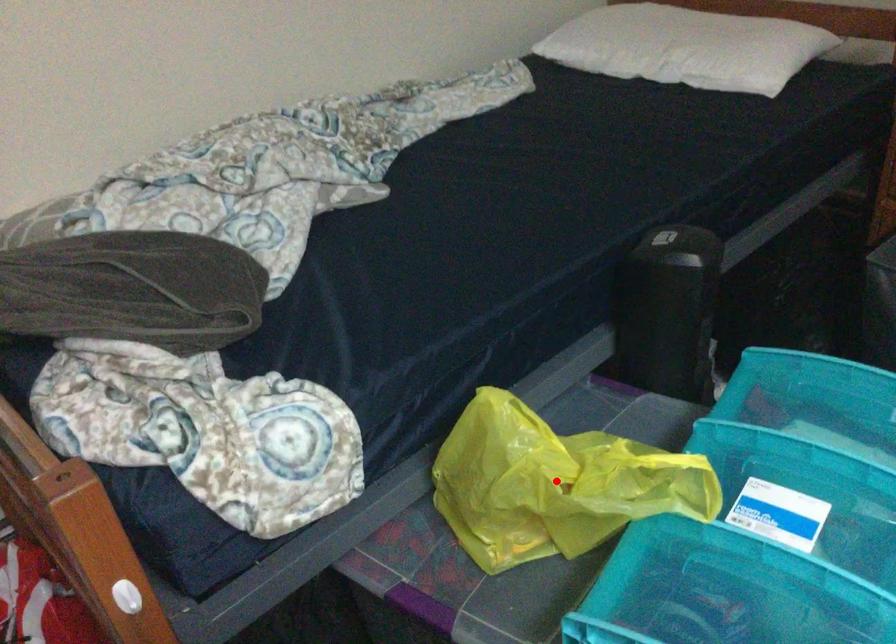
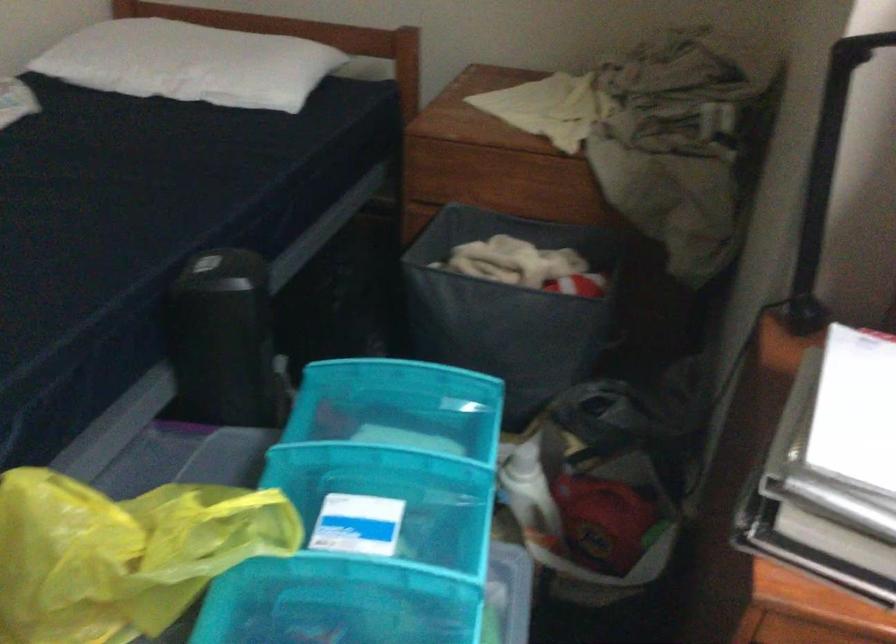
In the second image, find the point that corresponds to the highlighted location in the first image.

(122, 554)